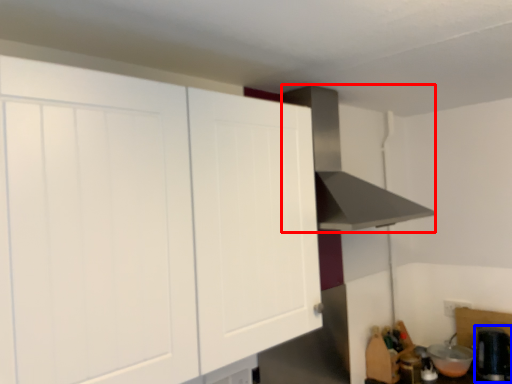
Question: Which of the following is the farthest to the observer, vent (highlighted by a red box) or appliance (highlighted by a blue box)?

Choices:
 (A) vent
 (B) appliance

Answer: (B)